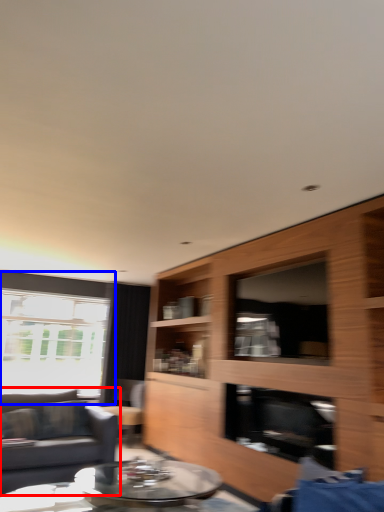
Question: Among these objects, which one is farthest to the camera, studio couch (highlighted by a red box) or window (highlighted by a blue box)?

Choices:
 (A) studio couch
 (B) window

Answer: (B)